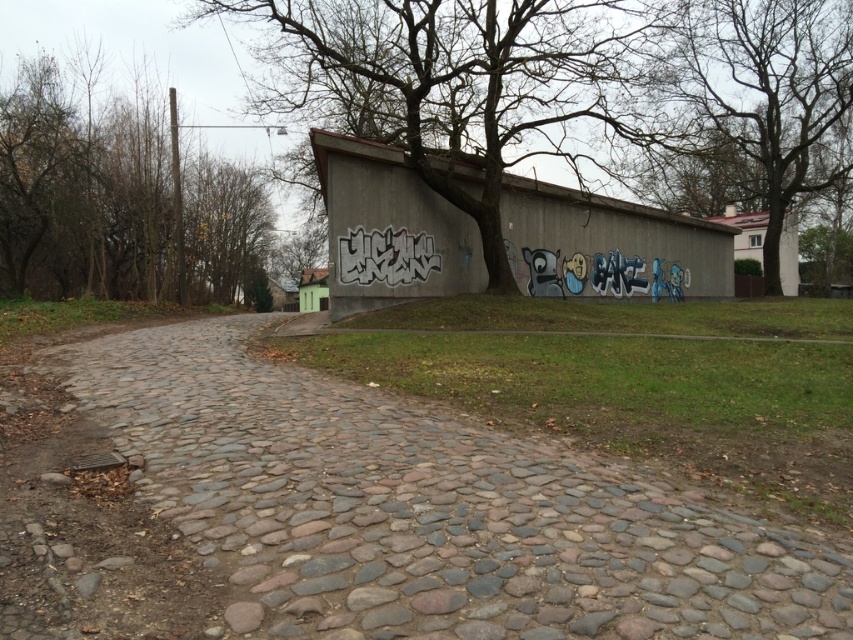
Question: Which point is farther from the camera taking this photo?

Choices:
 (A) (422, 12)
 (B) (674, 115)

Answer: (B)

Question: Does gray cobblestone path at center have a larger size compared to brown leafless tree at left?

Choices:
 (A) no
 (B) yes

Answer: (A)

Question: Which of the following is the closest to the observer?

Choices:
 (A) (496, 74)
 (B) (62, 200)
 (C) (231, 612)
 (D) (395, 260)

Answer: (C)

Question: Does bare branches at center appear on the right side of black graffiti at center?

Choices:
 (A) no
 (B) yes

Answer: (A)

Question: Is gray cobblestone path at center wider than black graffiti at center?

Choices:
 (A) yes
 (B) no

Answer: (A)

Question: Estimate the real-world distances between objects in this image. Which object is closer to the bare branches at center?

Choices:
 (A) black graffiti at center
 (B) brown leafless tree at left
 (C) gray cobblestone path at center
 (D) green leafy tree at upper center

Answer: (A)